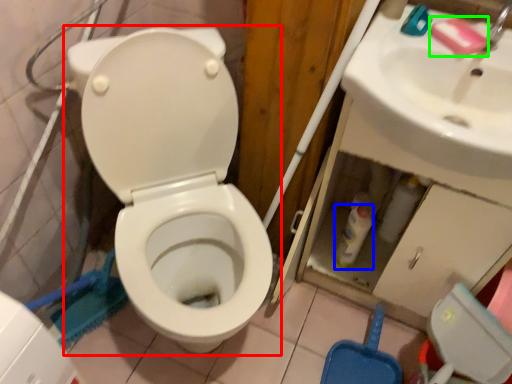
Question: Which object is positioned closest to toilet (highlighted by a red box)? Select from bottle (highlighted by a blue box) and soap (highlighted by a green box).

Choices:
 (A) bottle
 (B) soap

Answer: (A)